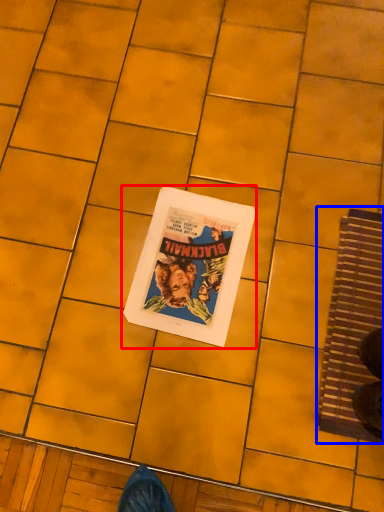
Question: Which object appears farthest to the camera in this image, paperback book (highlighted by a red box) or doormat (highlighted by a blue box)?

Choices:
 (A) paperback book
 (B) doormat

Answer: (A)